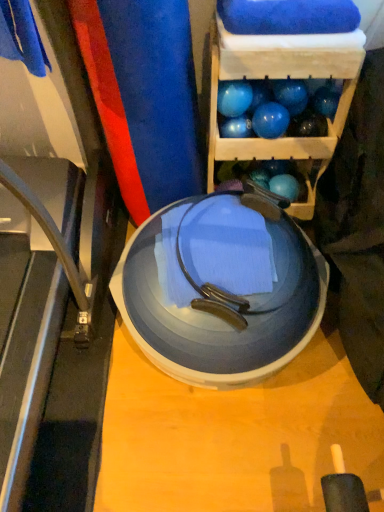
Locate an element on the screen. Image resolution: width=384 pixels, height=512 pixels. vacant region in front of transparent plastic plate at center is located at coordinates click(218, 451).